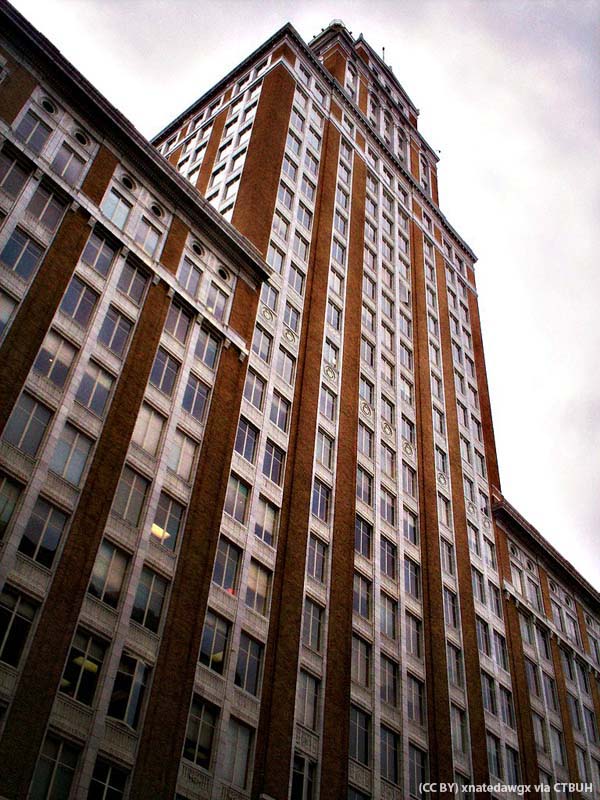
At what (x,y) coordinates should I click in order to perform the action: click on windows. Please return your answer as a coordinate pair (x, y). Image resolution: width=600 pixels, height=800 pixels. Looking at the image, I should click on (406, 266), (218, 645), (256, 593), (493, 700), (536, 594), (386, 336), (111, 586), (221, 149).